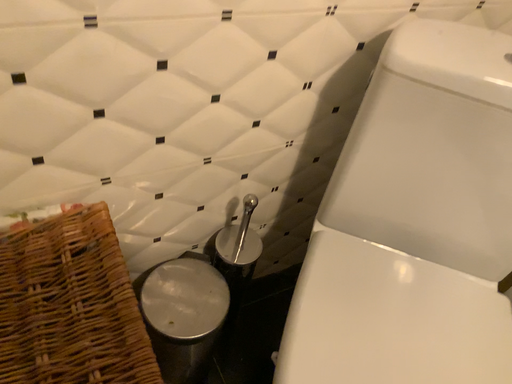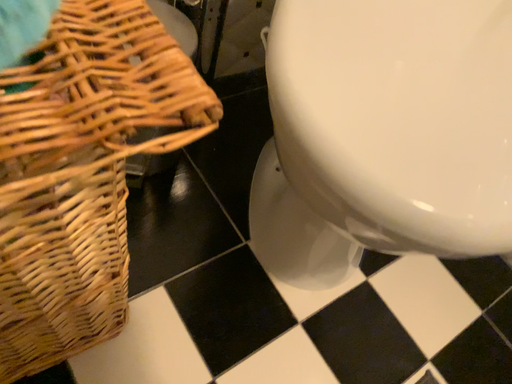
Question: How did the camera likely rotate when shooting the video?

Choices:
 (A) rotated downward
 (B) rotated upward

Answer: (A)